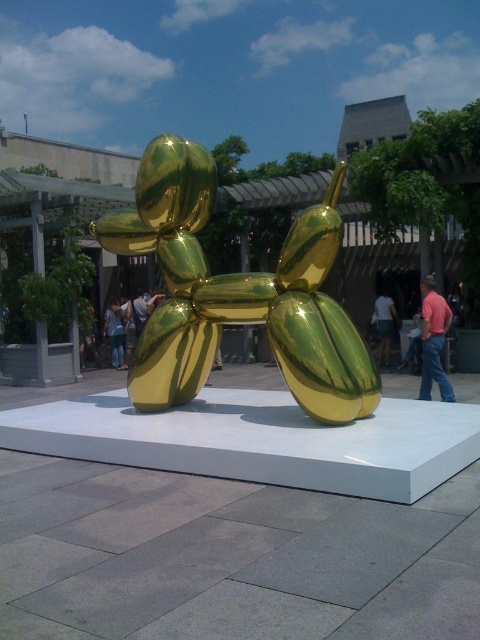
Consider the image. You are standing in front of the sculpture and want to take a photo of both the gold metallic balloon dog at center and the denim pants at lower left. Which object should you focus on first to ensure both are in focus?

You should focus on the gold metallic balloon dog at center first because it is closer to the viewer than the denim pants at lower left, so focusing on the closer object will help both be in focus.

You are standing in the outdoor area and see the golden sculpture of a balloon dog. There is a specific point at coordinates point (237, 292). Where exactly is this point located?

The point (237, 292) is on the gold metallic balloon dog at center.